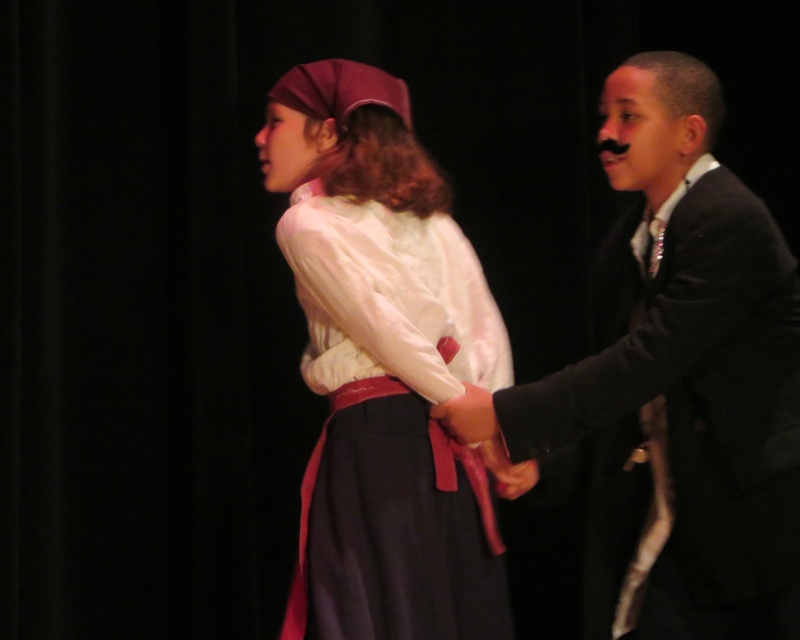
Is black satin suit at right thinner than matte white blouse at center?

No.

Is black satin suit at right below matte white blouse at center?

Indeed, black satin suit at right is positioned under matte white blouse at center.

Between point (613, 324) and point (306, 368), which one is positioned behind?

The point (613, 324) is behind.

In order to click on black satin suit at right in this screenshot , I will do `click(686, 369)`.

Which is above, black satin suit at right or smooth leather hand at center?

black satin suit at right is higher up.

Is point (754, 218) positioned behind point (496, 429)?

That is False.

This screenshot has height=640, width=800. What do you see at coordinates (686, 369) in the screenshot? I see `black satin suit at right` at bounding box center [686, 369].

The width and height of the screenshot is (800, 640). Identify the location of black satin suit at right. (686, 369).

Between point (381, 332) and point (480, 416), which one is positioned in front?

Point (381, 332) is more forward.

Based on the photo, does matte white blouse at center have a greater width compared to smooth leather hand at center?

Yes, matte white blouse at center is wider than smooth leather hand at center.

Find the location of a particular element. matte white blouse at center is located at coordinates (384, 365).